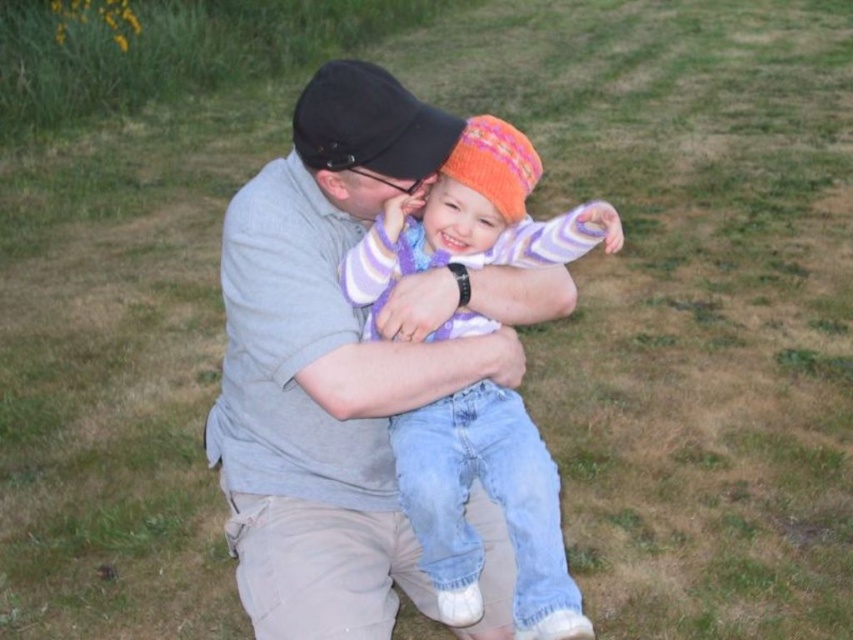
Question: Which of the following is the farthest from the observer?

Choices:
 (A) (486, 412)
 (B) (337, 109)

Answer: (A)

Question: Is knitted woolen hat at center bigger than black fabric cap at upper center?

Choices:
 (A) yes
 (B) no

Answer: (A)

Question: In this image, where is knitted woolen hat at center located relative to black fabric cap at upper center?

Choices:
 (A) below
 (B) above

Answer: (A)

Question: Can you confirm if knitted woolen hat at center is wider than black fabric cap at upper center?

Choices:
 (A) yes
 (B) no

Answer: (A)

Question: Which point appears farthest from the camera in this image?

Choices:
 (A) (518, 140)
 (B) (425, 120)

Answer: (A)